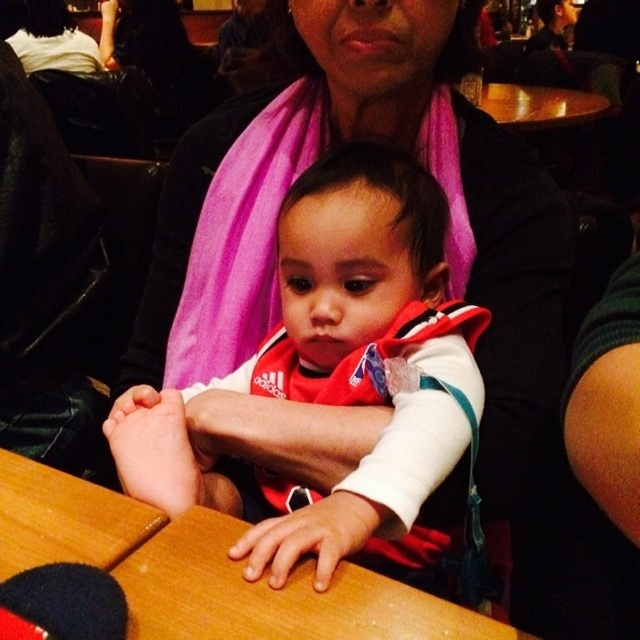
What is the exact position of the white matte baby at center in the image?

The white matte baby at center is located at point (339, 371).

You are a photographer trying to capture a closeup shot of the white matte baby at center and the wooden table at center. Since the background is slightly blurred, you need to adjust your camera focus. Which object should you focus on to ensure both are in focus, considering their sizes?

The white matte baby at center is taller than the wooden table at center, so focusing on the white matte baby at center would ensure both are in focus as it is the larger object.